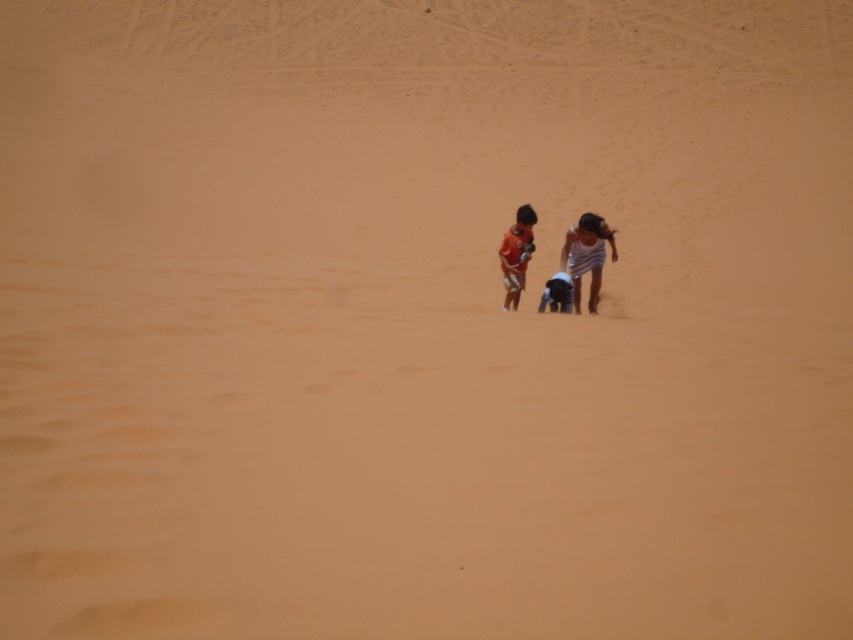
You are a photographer setting up a shot of the two children in the desert. You need to ensure that the white striped dress at center and the matte black shorts at center are both in frame. Which object should you focus on first to ensure both are fully captured?

The white striped dress at center might be wider than matte black shorts at center, so focusing on the white striped dress at center first would ensure that the wider object is fully in frame, allowing the matte black shorts at center to also be included.

You are standing in the desert and see two points marked on the sand. Which point is closer to you, point (579,285) or point (569,280)?

Point (569,280) is closer to you because it is less further to the viewer than point (579,285).

Where is the white striped dress at center located in the image?

The white striped dress at center is located at point (x=585, y=256) in the image.